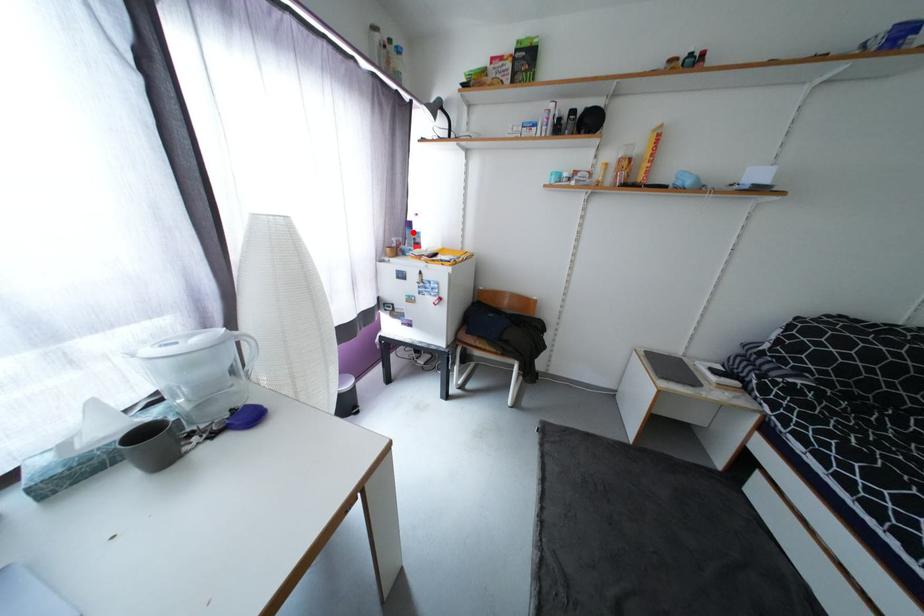
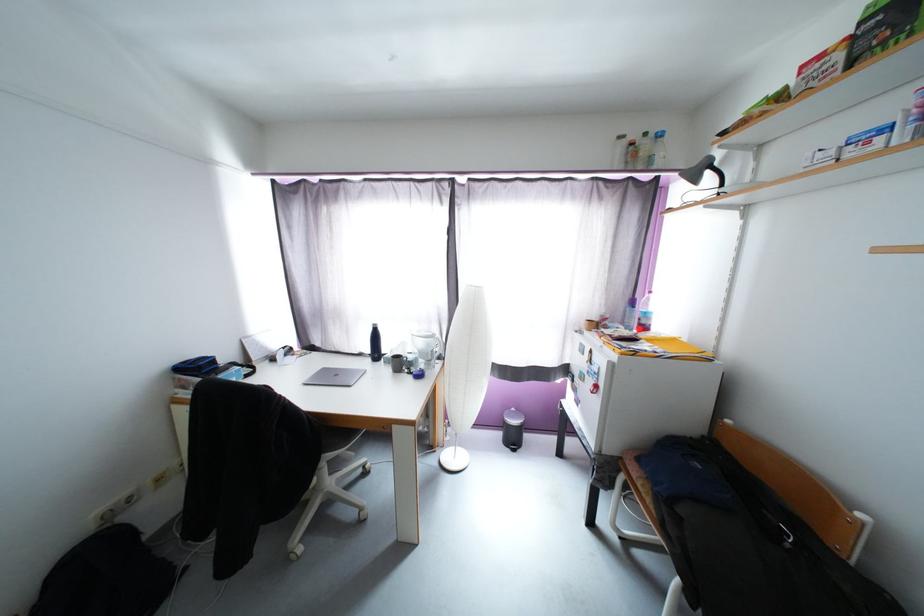
Question: A red point is marked in image1. In image2, is the corresponding 3D point closer to the camera or farther? Reply with the corresponding letter.

Choices:
 (A) The corresponding 3D point is closer.
 (B) The corresponding 3D point is farther.

Answer: (B)